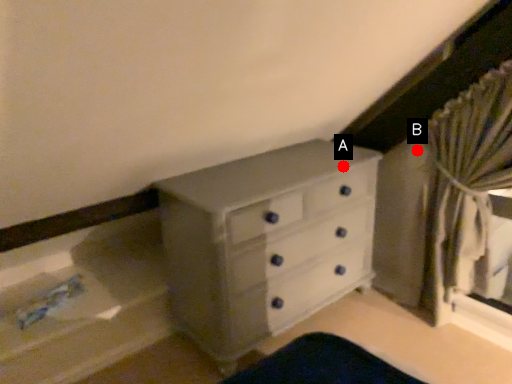
Question: Two points are circled on the image, labeled by A and B beside each circle. Which point is closer to the camera?

Choices:
 (A) A is closer
 (B) B is closer

Answer: (A)